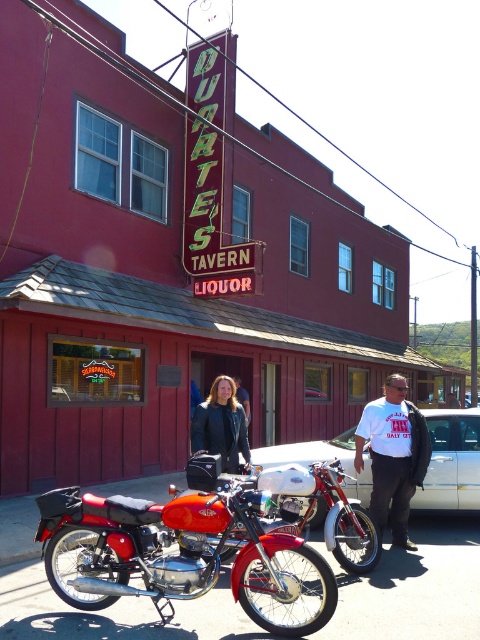
You are a delivery person who needs to park your delivery van, which is 2 meters wide, between the silver metallic car at center and the shiny chrome motorcycle at center. Based on the scene, can your van fit in the space between them?

The silver metallic car at center is thinner than the shiny chrome motorcycle at center, but the description does not provide the exact distance between them. Therefore, it is unclear if the 2 meter wide van can fit between them.

You are a delivery driver who needs to park your car next to the silver metallic car at center. According to the image, where should you park your car?

The silver metallic car at center is located at point [451,461], so you should park your car near that coordinate to be next to it.

You are a delivery person who needs to park your delivery van next to the Quartes Tavern Liquor. There is a silver metallic car at center and a shiny chrome motorcycle at center parked in the area. Can you determine which vehicle takes up more space in the parking spot?

The shiny chrome motorcycle at center takes up more space than the silver metallic car at center because the silver metallic car at center occupies less space than shiny chrome motorcycle at center.